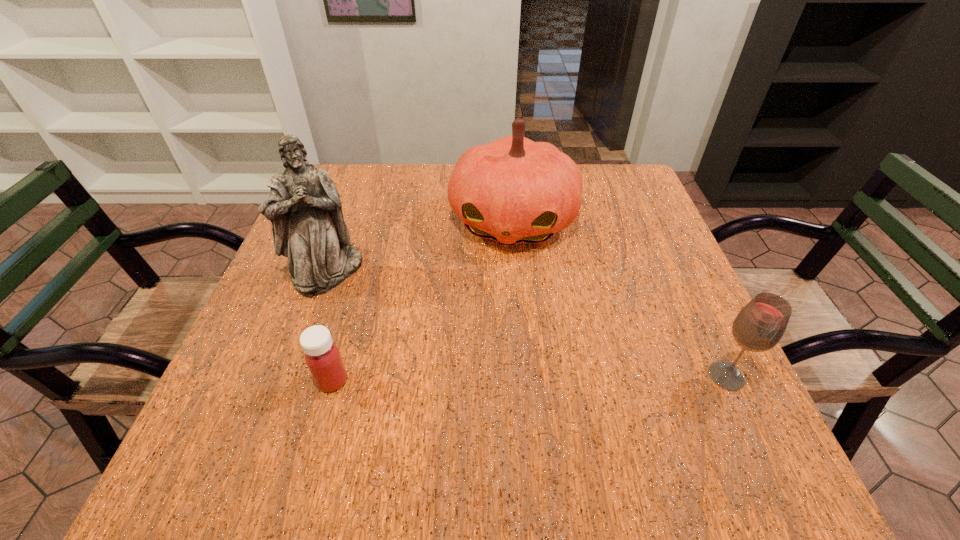
Find the location of a particular element. vacant region between the figurine and the third object from left to right is located at coordinates (420, 246).

You are a GUI agent. You are given a task and a screenshot of the screen. Output one action in this format:
    pyautogui.click(x=<x>, y=<y>)
    Task: Click on the vacant point located between the figurine and the glass drink container
    The width and height of the screenshot is (960, 540).
    Given the screenshot: What is the action you would take?
    [x=527, y=323]

Locate an element on the screen. This screenshot has height=540, width=960. free space between the pumpkin and the medicine is located at coordinates (422, 301).

At what (x,y) coordinates should I click in order to perform the action: click on empty location between the shortest object and the second shortest object. Please return your answer as a coordinate pair (x, y). The image size is (960, 540). Looking at the image, I should click on (529, 379).

The height and width of the screenshot is (540, 960). I want to click on free space that is in between the figurine and the pumpkin, so click(420, 246).

I want to click on free spot between the figurine and the shortest object, so click(330, 326).

Where is `free space between the shortest object and the figurine`? free space between the shortest object and the figurine is located at coordinates (330, 326).

This screenshot has height=540, width=960. Find the location of `free spot between the second shortest object and the figurine`. free spot between the second shortest object and the figurine is located at coordinates (527, 323).

This screenshot has width=960, height=540. In order to click on free space between the pumpkin and the figurine in this screenshot , I will do `click(420, 246)`.

Identify the location of unoccupied position between the glass drink container and the shortest object. (529, 379).